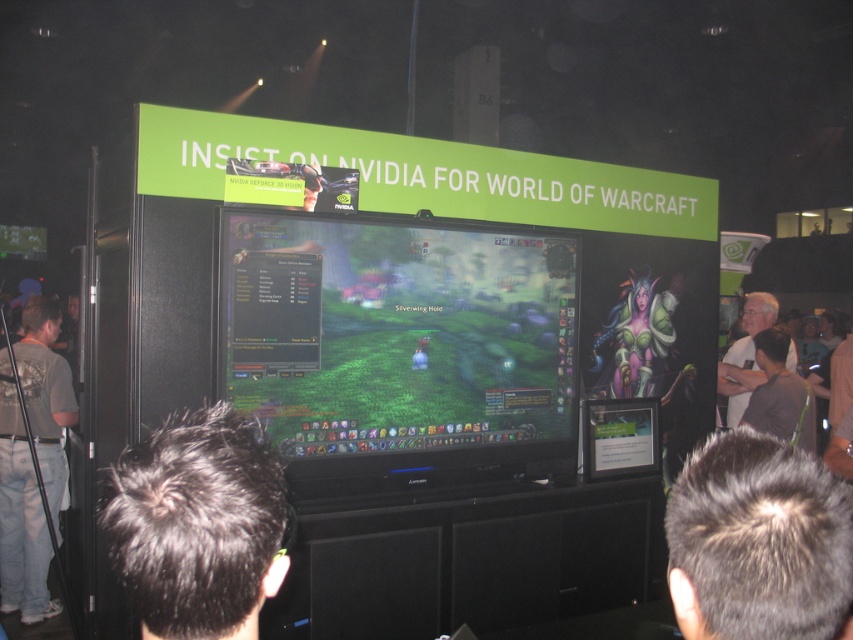
Question: Which object appears closest to the camera in this image?

Choices:
 (A) white matte shirt at right
 (B) dark hair at center

Answer: (B)

Question: Does dark hair at center appear over gray t-shirt at left?

Choices:
 (A) no
 (B) yes

Answer: (B)

Question: Does gray t-shirt at left appear on the right side of white matte shirt at right?

Choices:
 (A) yes
 (B) no

Answer: (B)

Question: Which point appears closest to the camera in this image?

Choices:
 (A) (222, 403)
 (B) (309, 445)
 (C) (24, 436)

Answer: (A)

Question: Does gray t-shirt at left have a larger size compared to white matte shirt at right?

Choices:
 (A) no
 (B) yes

Answer: (B)

Question: Based on their relative distances, which object is farther from the shiny black monitor at center?

Choices:
 (A) white matte shirt at right
 (B) gray t-shirt at left
 (C) dark hair at center

Answer: (C)